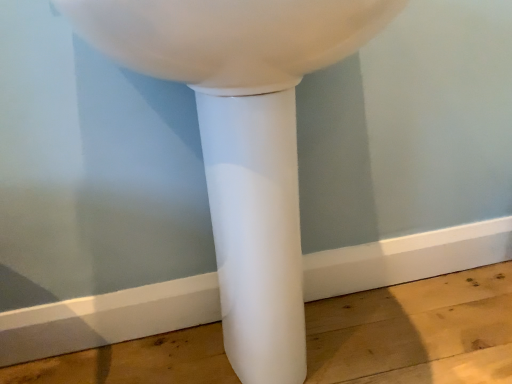
Find the location of a particular element. Image resolution: width=512 pixels, height=384 pixels. white glossy toilet at center is located at coordinates (243, 139).

What is the approximate height of white glossy toilet at center?

It is 31.35 inches.

What do you see at coordinates (243, 139) in the screenshot?
I see `white glossy toilet at center` at bounding box center [243, 139].

Locate an element on the screen. This screenshot has width=512, height=384. white glossy toilet at center is located at coordinates (243, 139).